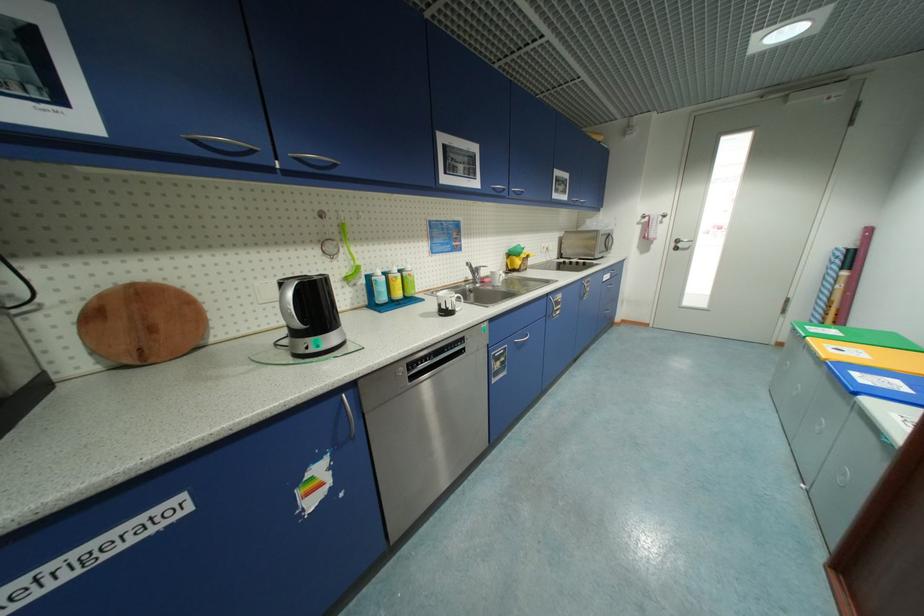
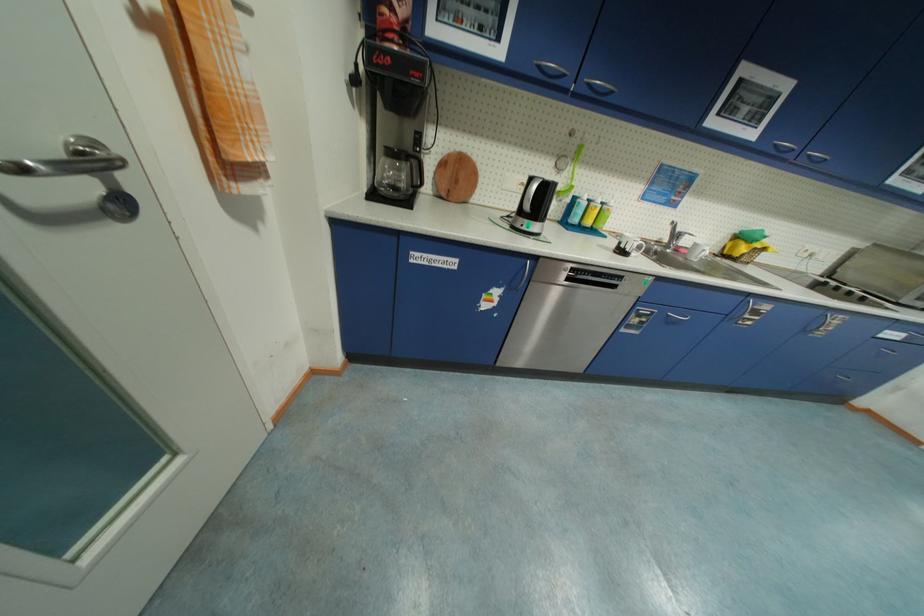
Where in the second image is the point corresponding to the point at 502,195 from the first image?

(780, 154)